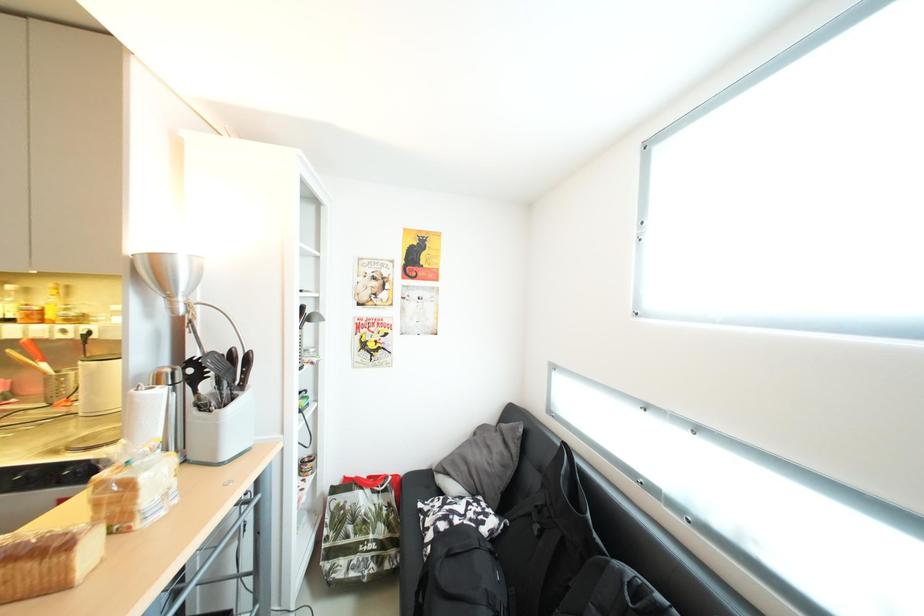
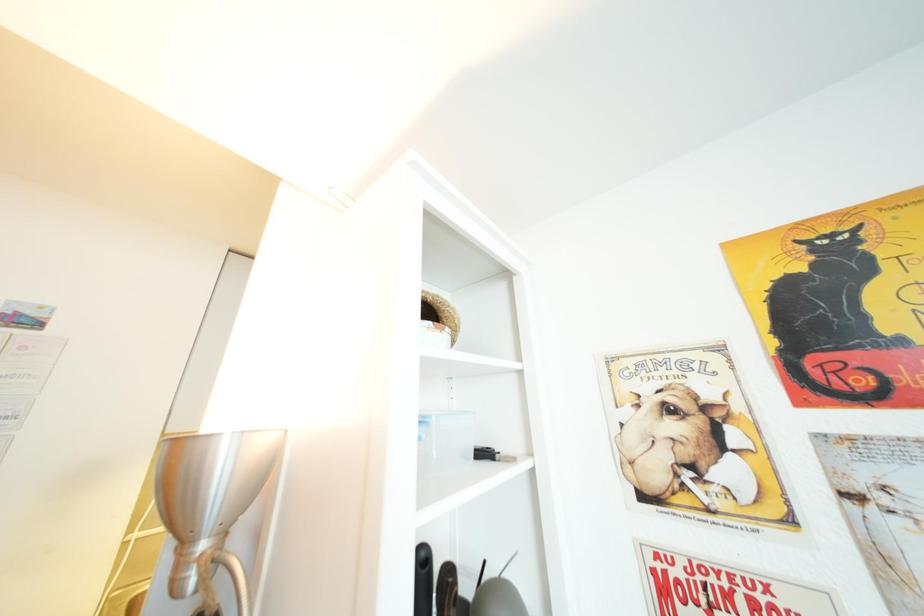
The first image is from the beginning of the video and the second image is from the end. How did the camera likely rotate when shooting the video?

The rotation direction of the camera is left-up.